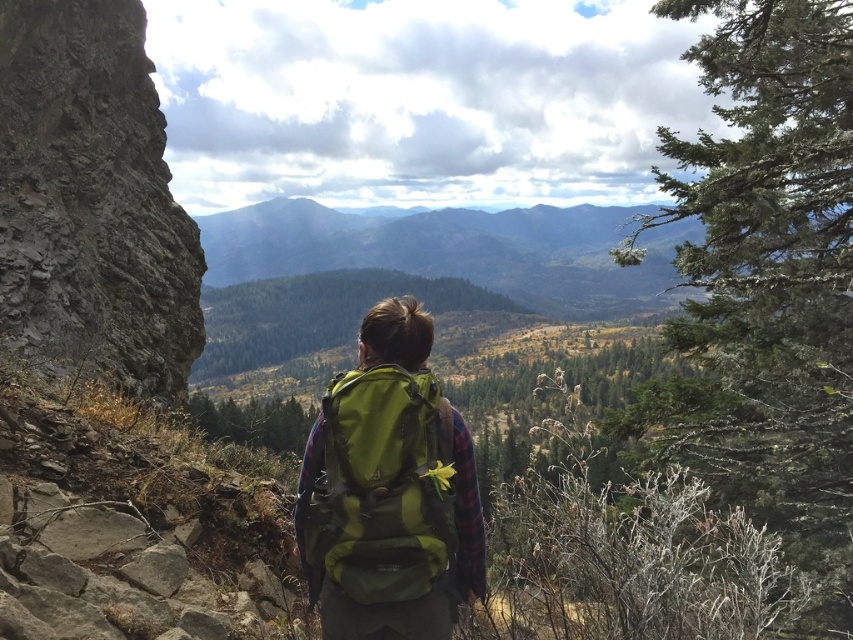
Question: Which point is farther from the camera taking this photo?

Choices:
 (A) (190, 257)
 (B) (358, 372)

Answer: (A)

Question: Is gray rough rock at left wider than green fabric backpack at center?

Choices:
 (A) yes
 (B) no

Answer: (A)

Question: Is gray rough rock at left wider than green fabric backpack at center?

Choices:
 (A) yes
 (B) no

Answer: (A)

Question: Is gray rough rock at left to the right of green fabric backpack at center from the viewer's perspective?

Choices:
 (A) yes
 (B) no

Answer: (B)

Question: Which object appears closest to the camera in this image?

Choices:
 (A) green fabric backpack at center
 (B) gray rough rock at left

Answer: (A)